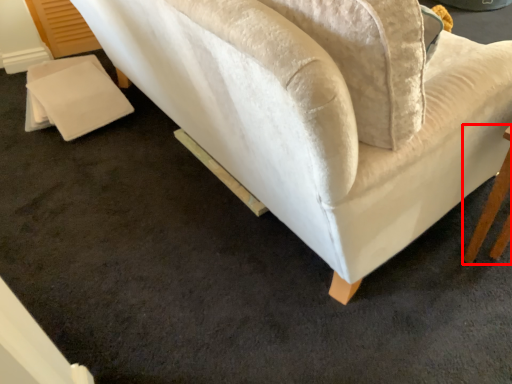
Question: From the image's perspective, where is table (annotated by the red box) located in relation to studio couch in the image?

Choices:
 (A) below
 (B) above

Answer: (A)